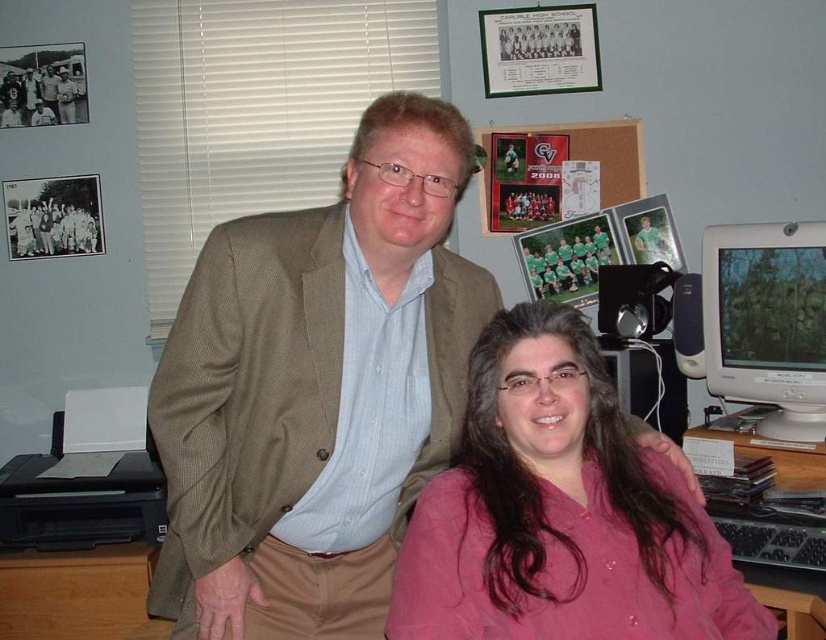
Question: Observing the image, what is the correct spatial positioning of brown wooden table at lower left in reference to wooden at right?

Choices:
 (A) left
 (B) right

Answer: (A)

Question: Which object is positioned closest to the wooden at right?

Choices:
 (A) matte white monitor at right
 (B) pink matte shirt at center
 (C) brown wooden table at lower left
 (D) matte brown blazer at center

Answer: (A)

Question: Is matte white monitor at right bigger than wooden at right?

Choices:
 (A) no
 (B) yes

Answer: (A)

Question: Where is pink matte shirt at center located in relation to brown wooden table at lower left in the image?

Choices:
 (A) above
 (B) below

Answer: (A)

Question: Which object appears closest to the camera in this image?

Choices:
 (A) matte white monitor at right
 (B) brown wooden table at lower left
 (C) matte brown blazer at center
 (D) wooden at right

Answer: (C)

Question: Among these objects, which one is nearest to the camera?

Choices:
 (A) pink matte shirt at center
 (B) matte brown blazer at center

Answer: (A)